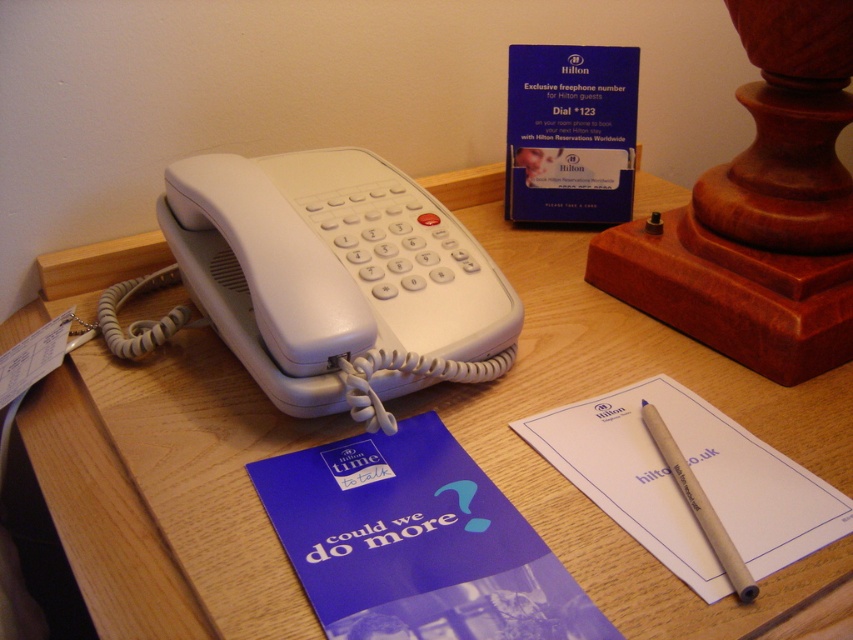
You are organizing the desk items and need to place the blue paper at center and the white paper at center into a folder. Which paper should you place first to ensure they fit properly?

The blue paper at center might be wider than white paper at center, so you should place the blue paper at center first to accommodate its width.

You are looking at the desk and want to place a small sticker exactly halfway between point (440, 630) and point (675, 468). Which point will the sticker be closer to?

The sticker will be closer to point (675, 468) because the midpoint between the two points would be closer to the point that is further from the camera.

You are organizing the desk and need to place a 10 cm wide notebook between the blue paper at center and the white paper at center. Will there be enough space?

The blue paper at center and white paper at center are 9.91 centimeters apart. Since the notebook is 10 cm wide, there isn not enough space to place it between them.